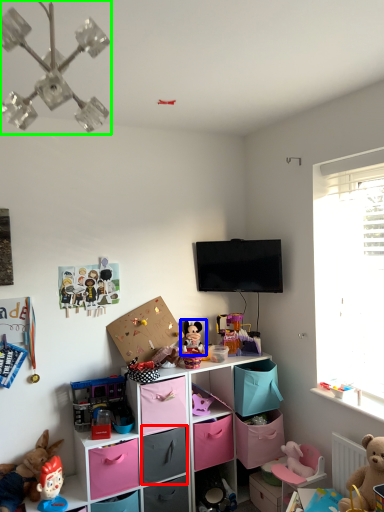
Question: Estimate the real-world distances between objects in this image. Which object is farther from drawer (highlighted by a red box), toy (highlighted by a blue box) or light fixture (highlighted by a green box)?

Choices:
 (A) toy
 (B) light fixture

Answer: (B)